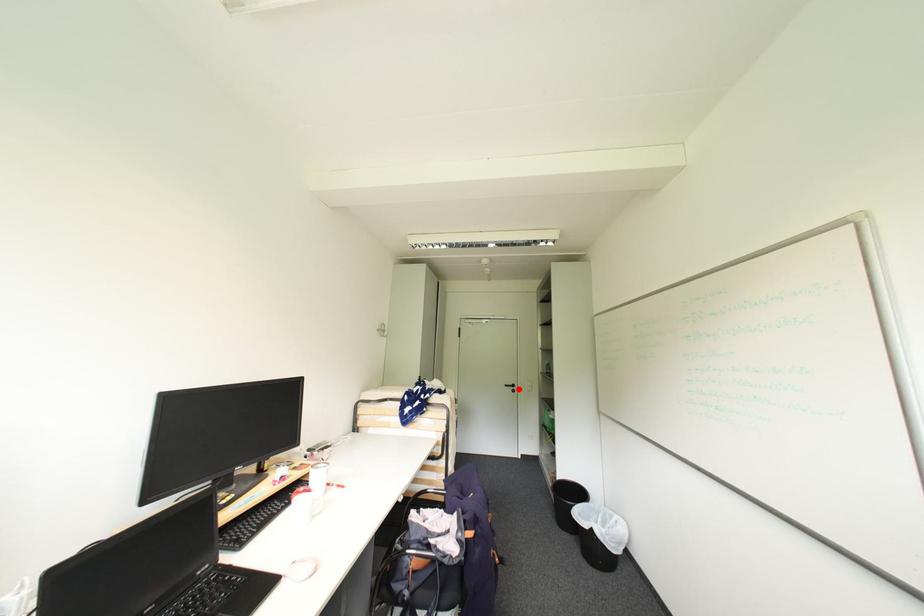
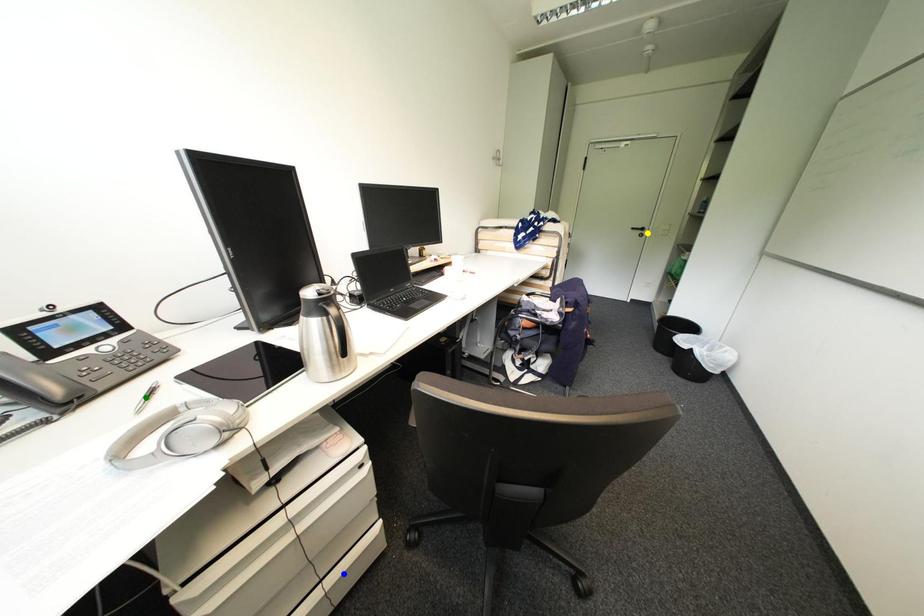
Question: I am providing you with two images of the same scene from different viewpoints. A red point is marked on the first image. You are given multiple points on the second image. Which spot in image 2 lines up with the point in image 1?

Choices:
 (A) yellow point
 (B) blue point
 (C) green point

Answer: (A)